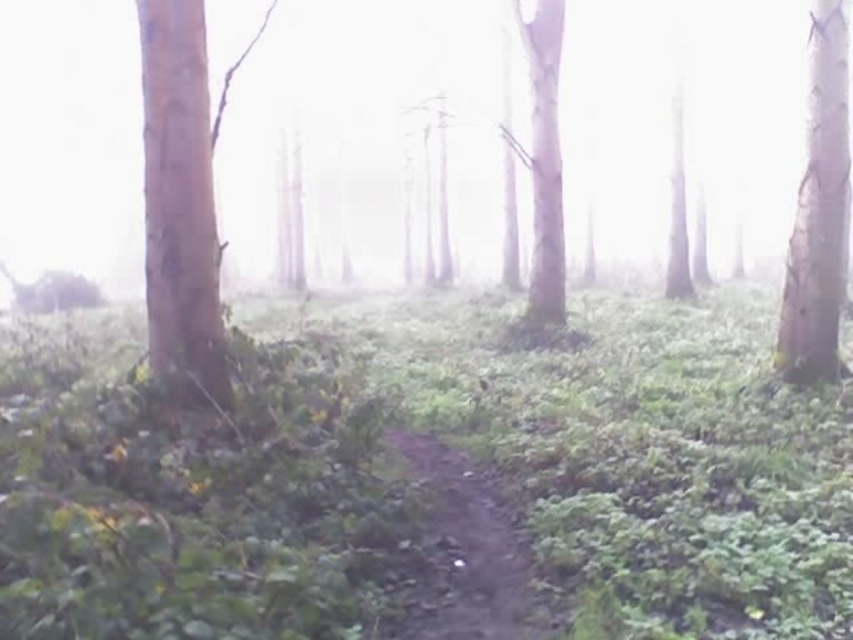
Who is higher up, foggy translucent forest at center or smooth bark tree at center?

foggy translucent forest at center

Can you confirm if foggy translucent forest at center is shorter than smooth bark tree at center?

Incorrect, foggy translucent forest at center's height does not fall short of smooth bark tree at center's.

Which is behind, point (572, 58) or point (534, 83)?

Positioned behind is point (572, 58).

Where is `foggy translucent forest at center`? Image resolution: width=853 pixels, height=640 pixels. foggy translucent forest at center is located at coordinates (346, 122).

Is green leafy vegetation at center above dirt path at center?

Yes, green leafy vegetation at center is above dirt path at center.

Between point (165, 483) and point (438, 515), which one is positioned behind?

Positioned behind is point (438, 515).

Between point (303, 369) and point (465, 524), which one is positioned behind?

Point (303, 369)

The image size is (853, 640). What are the coordinates of `green leafy vegetation at center` in the screenshot? It's located at (425, 480).

Is point (445, 595) positioned after point (844, 72)?

No, (445, 595) is closer to viewer.

Who is more distant from viewer, (x=473, y=490) or (x=821, y=340)?

The point (x=821, y=340) is behind.

Find the location of a particular element. dirt path at center is located at coordinates (469, 556).